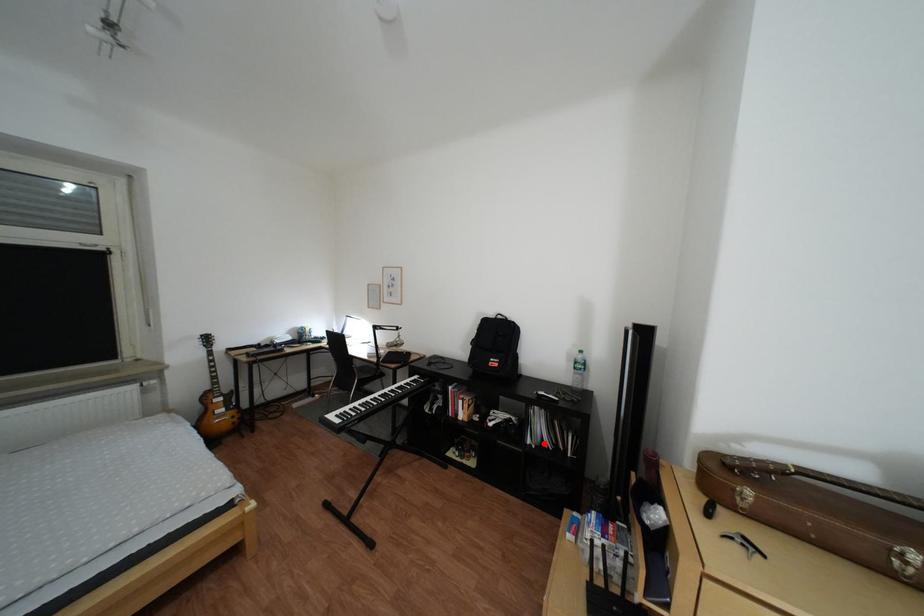
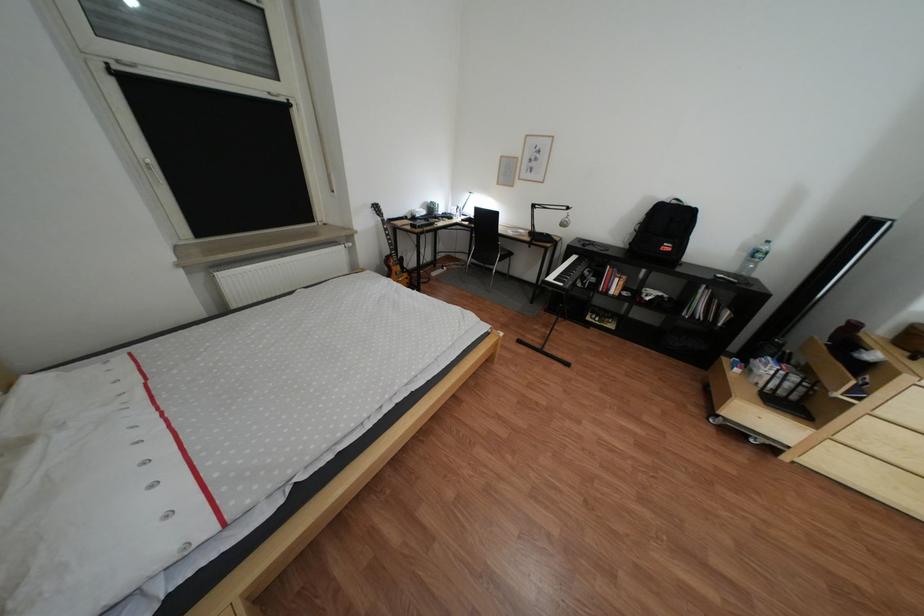
The point at the highlighted location is marked in the first image. Where is the corresponding point in the second image?

(699, 315)